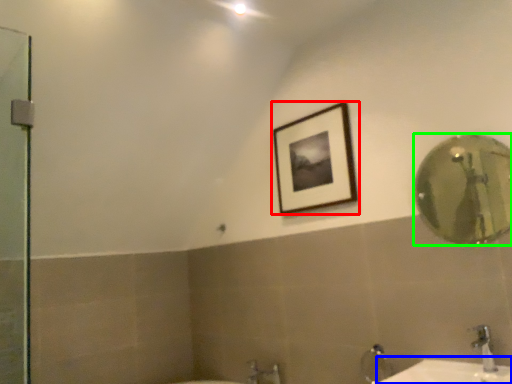
Question: Which object is the farthest from picture frame (highlighted by a red box)? Choose among these: counter top (highlighted by a blue box) or mirror (highlighted by a green box).

Choices:
 (A) counter top
 (B) mirror

Answer: (B)